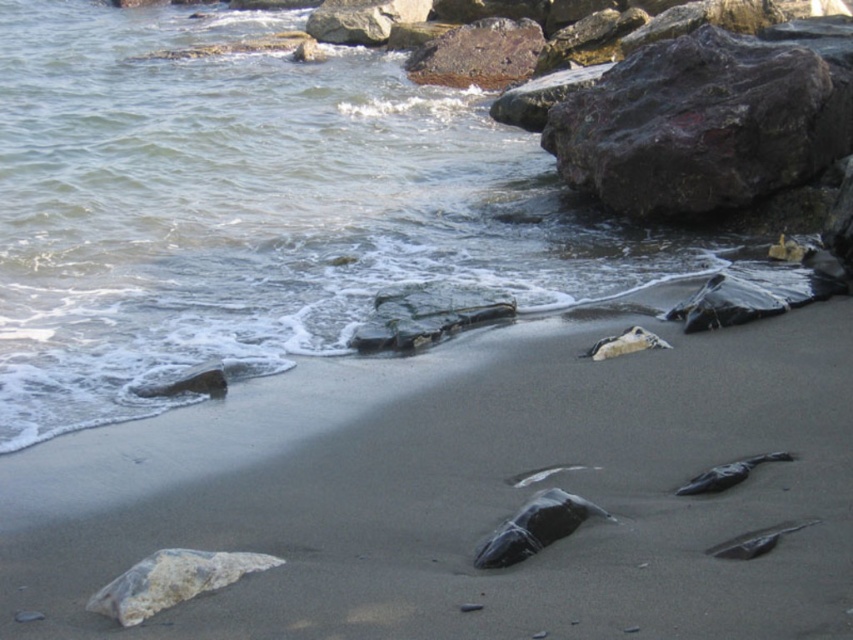
Question: Does smooth sand at lower center appear over rusty metallic rock at upper right?

Choices:
 (A) yes
 (B) no

Answer: (B)

Question: Can you confirm if smooth sand at lower center is positioned to the left of rusty metallic rock at upper right?

Choices:
 (A) no
 (B) yes

Answer: (B)

Question: Which of the following is the farthest from the observer?

Choices:
 (A) rusty metallic rock at upper right
 (B) smooth sand at lower center

Answer: (A)

Question: Does smooth sand at lower center have a lesser width compared to rusty metallic rock at upper right?

Choices:
 (A) yes
 (B) no

Answer: (B)